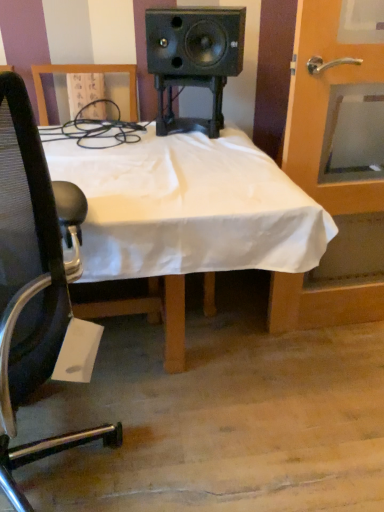
At what (x,y) coordinates should I click in order to perform the action: click on vacant space underneath black mesh chair at left (from a real-world perspective). Please return your answer as a coordinate pair (x, y). The image size is (384, 512). Looking at the image, I should click on (82, 490).